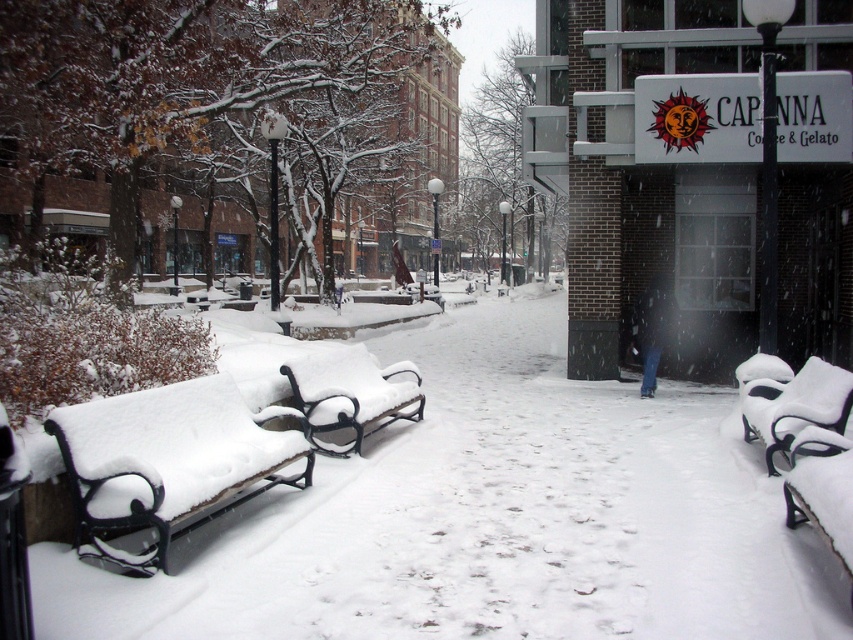
Question: Can you confirm if snow-covered metal bench at left is bigger than snow-covered metal bench at center?

Choices:
 (A) no
 (B) yes

Answer: (A)

Question: Which is nearer to the snow-covered metal bench at center?

Choices:
 (A) white matte park bench at lower right
 (B) snow-covered metal bench at left

Answer: (B)

Question: Which point is closer to the camera?

Choices:
 (A) snow-covered metal bench at center
 (B) white matte park bench at lower right
 (C) snow-covered metal bench at left

Answer: (C)

Question: Does snow-covered metal bench at center have a smaller size compared to white matte park bench at lower right?

Choices:
 (A) yes
 (B) no

Answer: (B)

Question: Is snow-covered metal bench at center positioned at the back of white matte park bench at lower right?

Choices:
 (A) no
 (B) yes

Answer: (B)

Question: Which point is farther to the camera?

Choices:
 (A) (263, 410)
 (B) (817, 369)

Answer: (B)